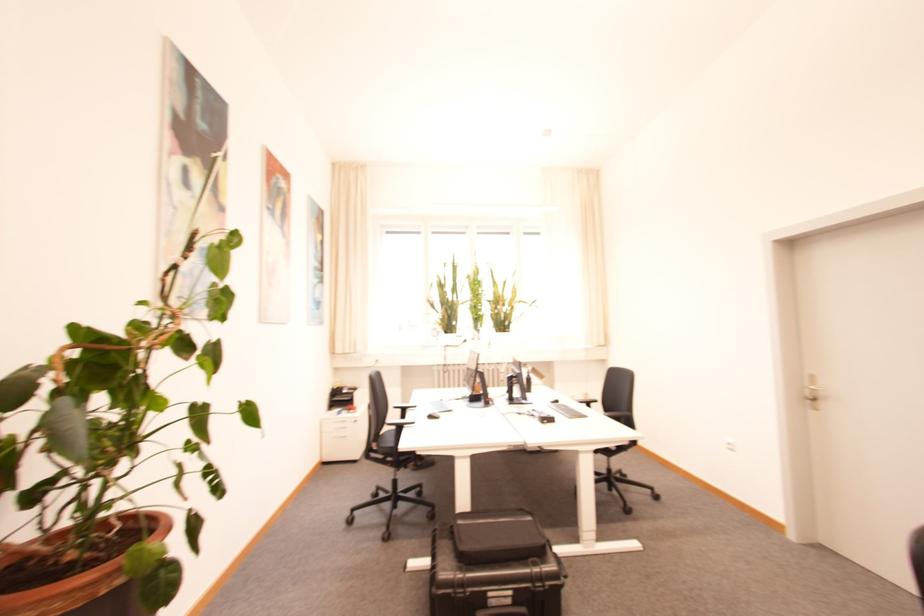
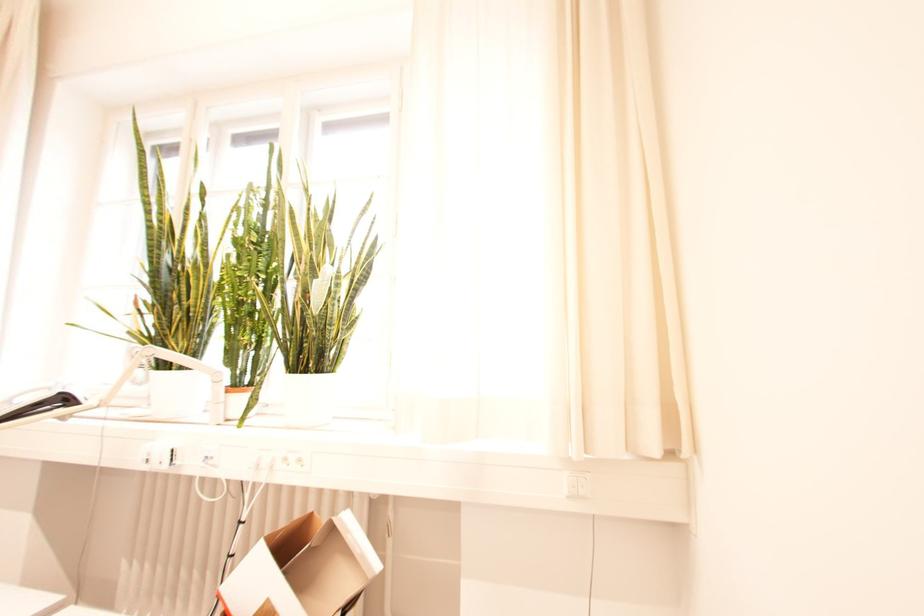
From the picture: In a continuous first-person perspective shot, in which direction is the camera moving?

The cameraman walked toward right, forward.